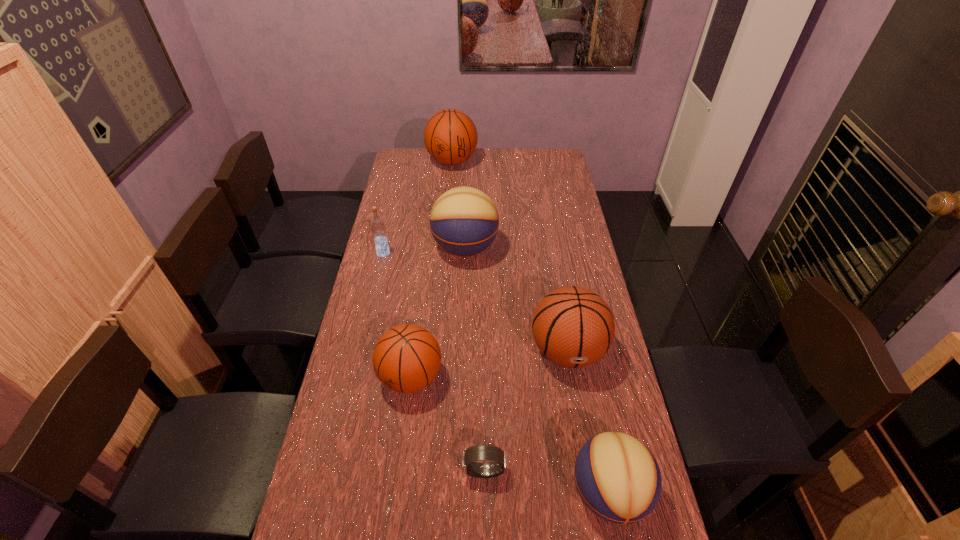
The height and width of the screenshot is (540, 960). I want to click on vacant area between the watch and the left blue basketball, so click(x=474, y=360).

Identify the location of object that stands as the fourth closest to the shortest object. The height and width of the screenshot is (540, 960). (464, 221).

Where is `object that is the nearest to the smallest orange basketball`? The width and height of the screenshot is (960, 540). object that is the nearest to the smallest orange basketball is located at coordinates (479, 452).

Identify which basketball is the third nearest to the blue vodka. Please provide its 2D coordinates. Your answer should be formatted as a tuple, i.e. [(x, y)], where the tuple contains the x and y coordinates of a point satisfying the conditions above.

[(450, 136)]

Choose which basketball is the fourth nearest neighbor to the shortest object. Please provide its 2D coordinates. Your answer should be formatted as a tuple, i.e. [(x, y)], where the tuple contains the x and y coordinates of a point satisfying the conditions above.

[(464, 221)]

Where is `orange basketball that is the second nearest to the leftmost object`? orange basketball that is the second nearest to the leftmost object is located at coordinates (450, 136).

Identify the location of orange basketball that stands as the third closest to the right blue basketball. (450, 136).